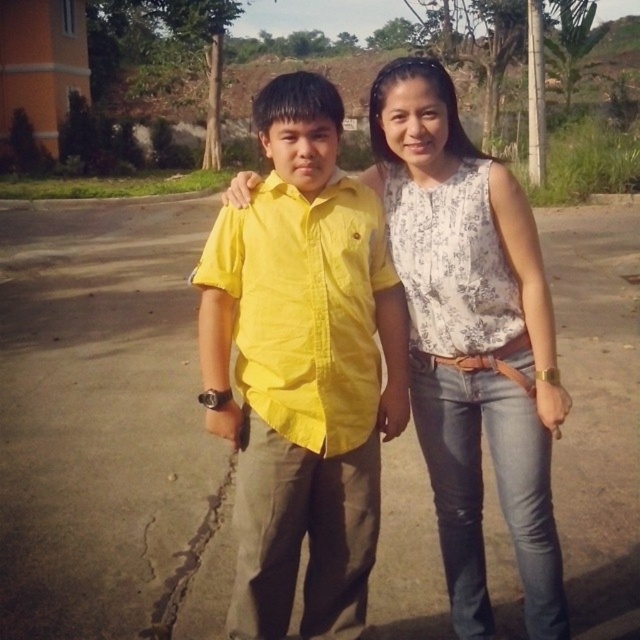
You are a photographer trying to capture both the yellow cotton shirt at center and the white floral blouse at center in a single frame. Considering their sizes, which one should you focus on to ensure both fit comfortably in the photo?

Since the yellow cotton shirt at center is smaller than the white floral blouse at center, you should focus on framing the photo so that the yellow cotton shirt at center is positioned closer to the camera while keeping the white floral blouse at center slightly farther back. This way, both will fit comfortably in the frame.

You are a photographer trying to capture a photo of both the yellow cotton shirt at center and the white floral blouse at center. Based on their positions, which one should you focus on first if you want to ensure both are in the frame?

The yellow cotton shirt at center is located below the white floral blouse at center, so you should focus on the white floral blouse at center first to ensure both are in the frame.